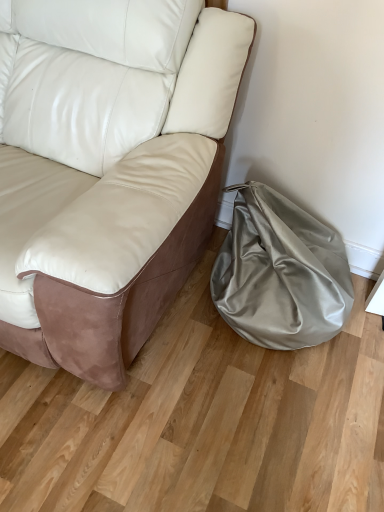
Question: Should I look upward or downward to see white leather couch at center?

Choices:
 (A) down
 (B) up

Answer: (B)

Question: Considering the relative sizes of satin beige bean bag at lower right and white leather couch at center in the image provided, is satin beige bean bag at lower right smaller than white leather couch at center?

Choices:
 (A) no
 (B) yes

Answer: (B)

Question: From a real-world perspective, is satin beige bean bag at lower right on top of white leather couch at center?

Choices:
 (A) yes
 (B) no

Answer: (B)

Question: Is satin beige bean bag at lower right completely or partially outside of white leather couch at center?

Choices:
 (A) yes
 (B) no

Answer: (A)

Question: Can you confirm if satin beige bean bag at lower right is thinner than white leather couch at center?

Choices:
 (A) yes
 (B) no

Answer: (A)

Question: Considering the relative sizes of satin beige bean bag at lower right and white leather couch at center in the image provided, is satin beige bean bag at lower right taller than white leather couch at center?

Choices:
 (A) no
 (B) yes

Answer: (A)

Question: Is the depth of satin beige bean bag at lower right greater than that of white leather couch at center?

Choices:
 (A) yes
 (B) no

Answer: (A)

Question: Is white leather couch at center with satin beige bean bag at lower right?

Choices:
 (A) no
 (B) yes

Answer: (A)

Question: From the image's perspective, is white leather couch at center located beneath satin beige bean bag at lower right?

Choices:
 (A) no
 (B) yes

Answer: (A)

Question: Is white leather couch at center outside of satin beige bean bag at lower right?

Choices:
 (A) no
 (B) yes

Answer: (B)

Question: From the image's perspective, is white leather couch at center located above satin beige bean bag at lower right?

Choices:
 (A) yes
 (B) no

Answer: (A)

Question: Considering the relative sizes of white leather couch at center and satin beige bean bag at lower right in the image provided, is white leather couch at center thinner than satin beige bean bag at lower right?

Choices:
 (A) no
 (B) yes

Answer: (A)

Question: Is white leather couch at center smaller than satin beige bean bag at lower right?

Choices:
 (A) yes
 (B) no

Answer: (B)

Question: Looking at the image, does satin beige bean bag at lower right seem bigger or smaller compared to white leather couch at center?

Choices:
 (A) big
 (B) small

Answer: (B)